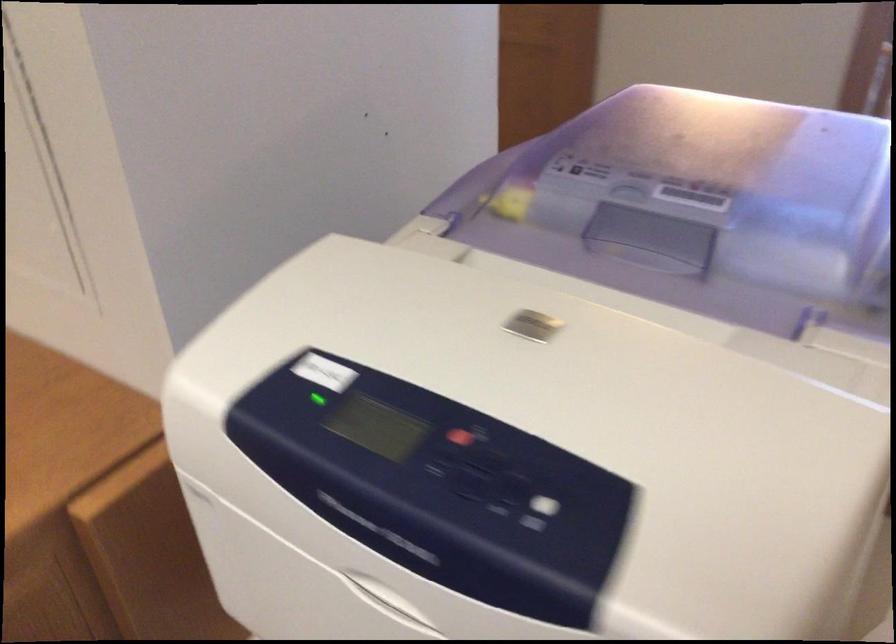
Locate an element on the screen. This screenshot has height=644, width=896. white square button is located at coordinates (538, 512).